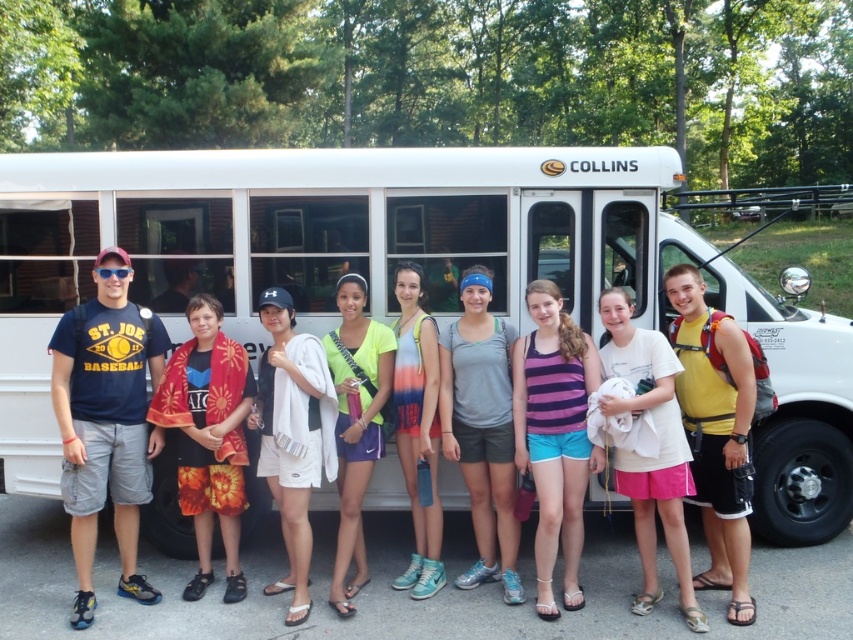
What is located at the point with coordinates (207, 436) in the image?

The point at (207, 436) indicates the location of the floral towel at center.

You are a photographer trying to capture the white matte school bus at center and the floral towel at center in a single shot. Based on their positions, which object is closer to the camera?

The white matte school bus at center is positioned over the floral towel at center, meaning the school bus is closer to the camera than the floral towel.